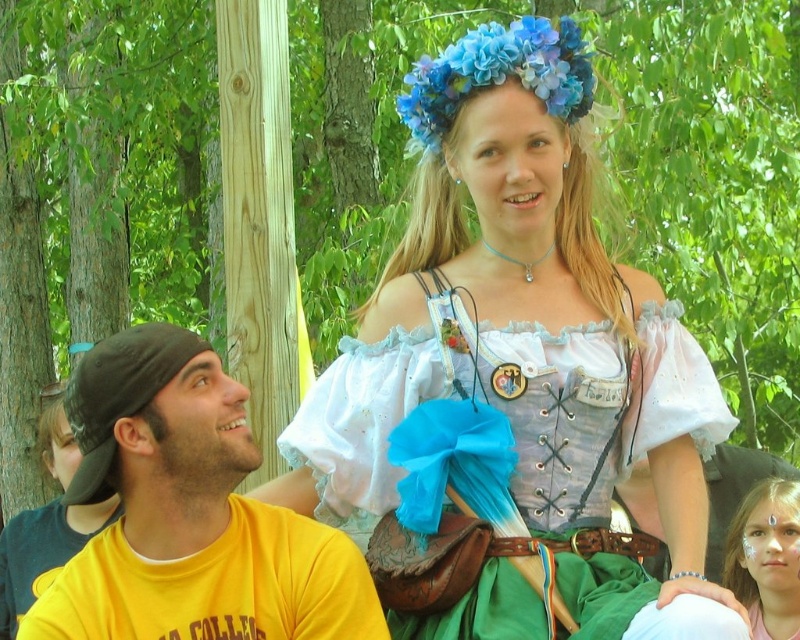
You are standing at the origin point in the image and want to move towards the two points labeled as point (x=604, y=432) and point (x=788, y=556). Which point will you reach first?

Point (x=604, y=432) is in front of point (x=788, y=556), so you will reach point (x=604, y=432) first.

You are an artist trying to sketch this scene. You want to ensure the proportions are accurate. Which object should you draw first, the matte white blouse at center or the matte pink face paint at lower right, and why?

You should draw the matte white blouse at center first because it is much taller than the matte pink face paint at lower right, so starting with the larger object ensures proper scaling for the smaller one.